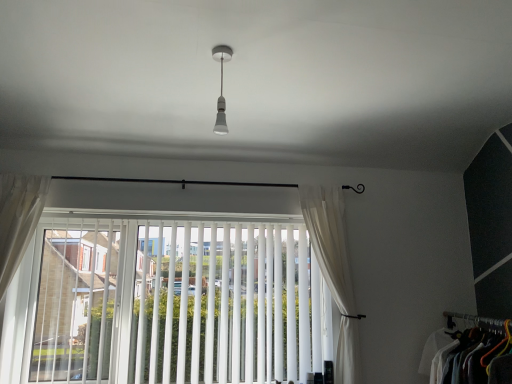
Question: Is white sheer curtain at left, acting as the first curtain starting from the left, inside the boundaries of white vertical blinds at center, or outside?

Choices:
 (A) outside
 (B) inside

Answer: (A)

Question: From the image's perspective, relative to white vertical blinds at center, is white sheer curtain at left, acting as the first curtain starting from the left, above or below?

Choices:
 (A) below
 (B) above

Answer: (B)

Question: Which is farther from the white vertical blinds at center?

Choices:
 (A) white sheer curtain at left, which is the second curtain from right to left
 (B) matte white light bulb at center
 (C) white fabric clothes at lower right
 (D) white sheer curtain at right, arranged as the second curtain when viewed from the left

Answer: (C)

Question: Which of these objects is positioned farthest from the white sheer curtain at left, which is the second curtain from right to left?

Choices:
 (A) white vertical blinds at center
 (B) matte white light bulb at center
 (C) white sheer curtain at right, which appears as the first curtain when viewed from the right
 (D) white fabric clothes at lower right

Answer: (D)